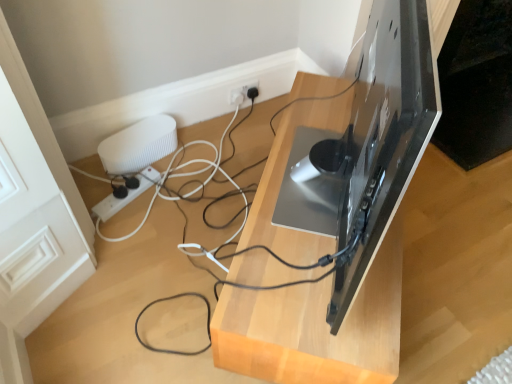
Locate an element on the screen. This screenshot has width=512, height=384. free region on the left part of white plastic power strip at lower left is located at coordinates (97, 190).